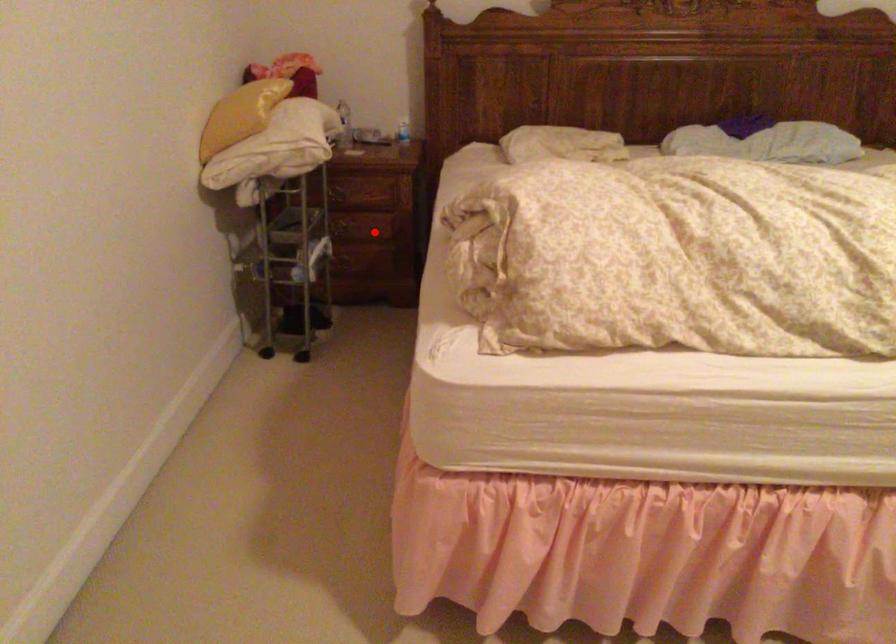
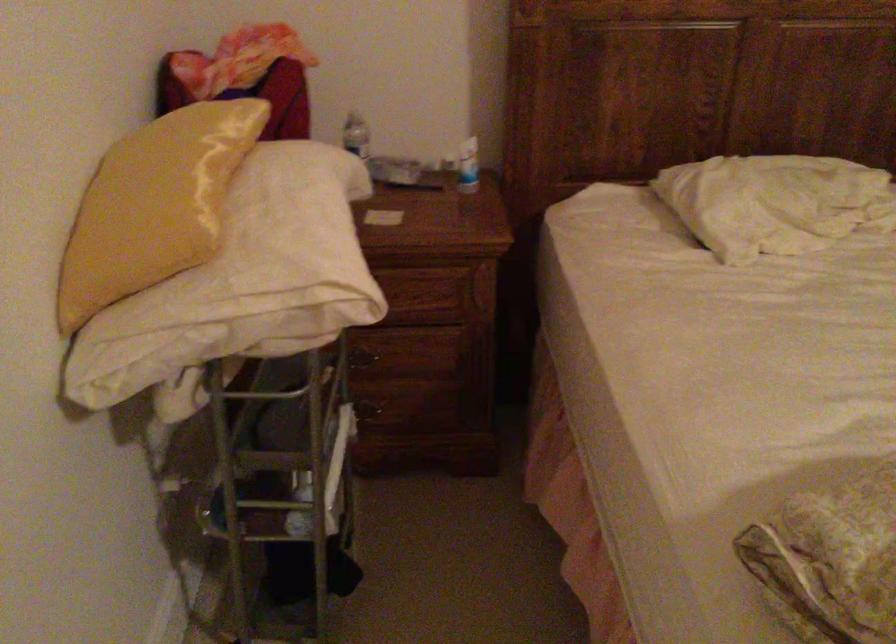
Where in the second image is the point corresponding to the highlighted location from the first image?

(412, 365)